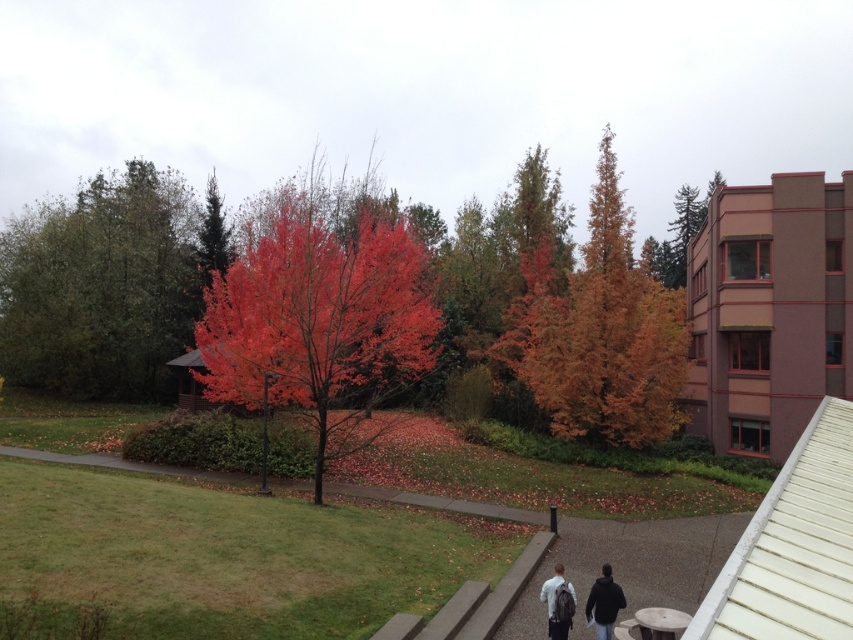
Question: Does gravel path at lower center appear on the left side of black matte jacket at lower center?

Choices:
 (A) yes
 (B) no

Answer: (A)

Question: Among these points, which one is nearest to the camera?

Choices:
 (A) (606, 593)
 (B) (546, 584)

Answer: (A)

Question: Can you confirm if gravel path at lower center is positioned above dark gray backpack at center?

Choices:
 (A) no
 (B) yes

Answer: (A)

Question: Does shiny red leaves at center have a larger size compared to gravel path at lower center?

Choices:
 (A) no
 (B) yes

Answer: (B)

Question: Which of the following is the closest to the observer?

Choices:
 (A) click(x=608, y=627)
 (B) click(x=3, y=333)
 (C) click(x=514, y=316)

Answer: (A)

Question: Estimate the real-world distances between objects in this image. Which object is closer to the orange matte tree at center?

Choices:
 (A) black matte jacket at lower center
 (B) green matte tree at upper left

Answer: (A)